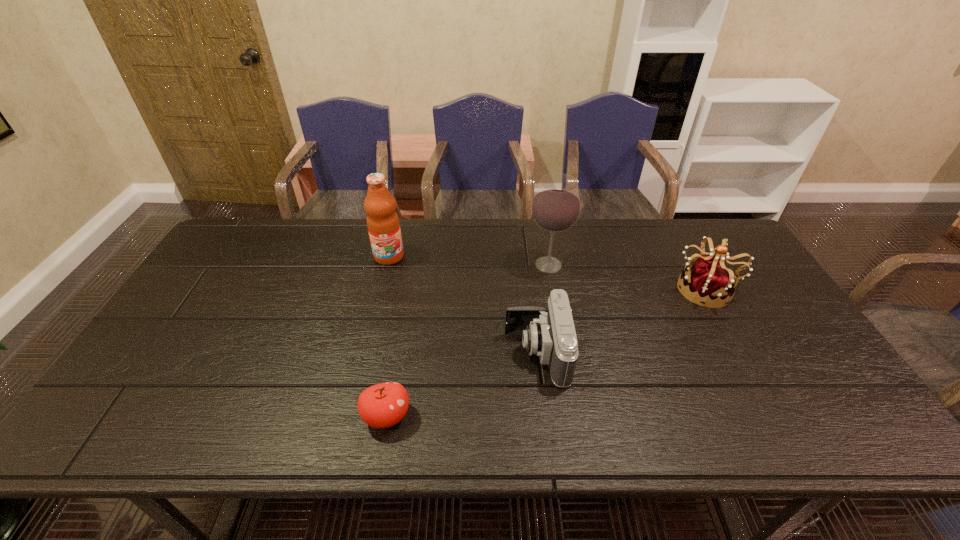
Locate an element on the screen. The height and width of the screenshot is (540, 960). free region that satisfies the following two spatial constraints: 1. on the front label of the fruit juice; 2. on the left side of the nearest object is located at coordinates pos(350,416).

This screenshot has height=540, width=960. What are the coordinates of `free space in the image that satisfies the following two spatial constraints: 1. on the front label of the fruit juice; 2. on the right side of the apple` in the screenshot? It's located at (350, 416).

You are a GUI agent. You are given a task and a screenshot of the screen. Output one action in this format:
    pyautogui.click(x=<x>, y=<y>)
    Task: Click on the vacant space that satisfies the following two spatial constraints: 1. on the front label of the fruit juice; 2. on the right side of the alcohol
    This screenshot has height=540, width=960.
    Given the screenshot: What is the action you would take?
    pyautogui.click(x=387, y=265)

Where is `vacant space that satisfies the following two spatial constraints: 1. on the front label of the fruit juice; 2. on the left side of the alcohol`? vacant space that satisfies the following two spatial constraints: 1. on the front label of the fruit juice; 2. on the left side of the alcohol is located at coordinates (387, 265).